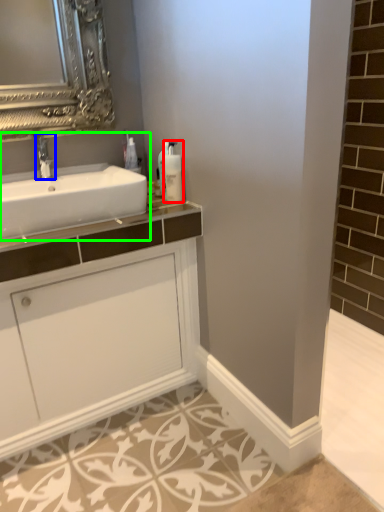
Question: Which object is positioned farthest from soap dispenser (highlighted by a red box)? Select from tap (highlighted by a blue box) and sink (highlighted by a green box).

Choices:
 (A) tap
 (B) sink

Answer: (A)